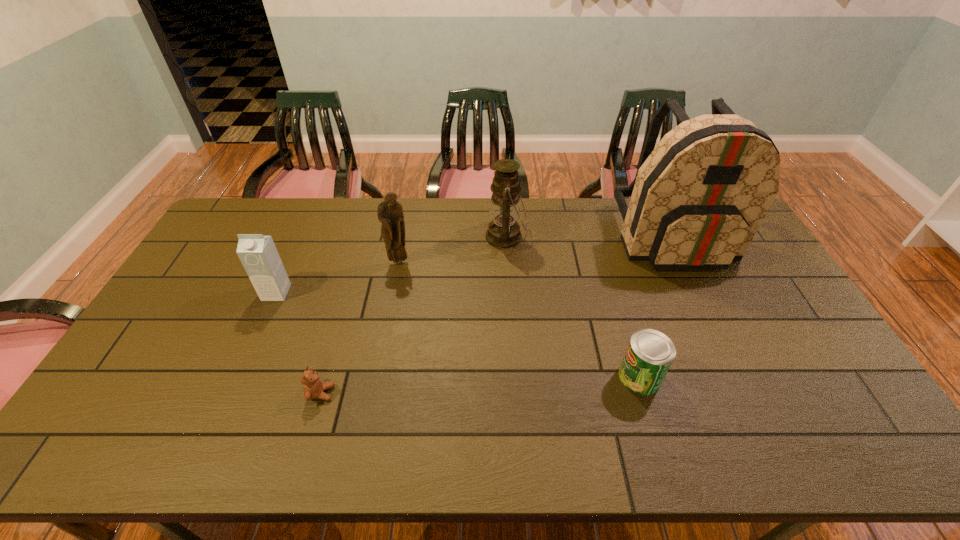
The image size is (960, 540). In order to click on vacant space at the far edge in this screenshot , I will do `click(455, 216)`.

At what (x,y) coordinates should I click in order to perform the action: click on free spot at the near edge of the desktop. Please return your answer as a coordinate pair (x, y). Image resolution: width=960 pixels, height=540 pixels. Looking at the image, I should click on (458, 434).

This screenshot has width=960, height=540. Find the location of `vacant space at the left edge of the desktop`. vacant space at the left edge of the desktop is located at coordinates (198, 315).

This screenshot has width=960, height=540. I want to click on vacant area at the right edge, so click(775, 281).

Where is `vacant area between the third nearest object and the fourth object from left to right`? This screenshot has width=960, height=540. vacant area between the third nearest object and the fourth object from left to right is located at coordinates (391, 265).

This screenshot has height=540, width=960. In order to click on vacant region between the second object from left to right and the figurine in this screenshot , I will do `click(360, 328)`.

Locate an element on the screen. The height and width of the screenshot is (540, 960). free space between the fourth object from right to left and the can is located at coordinates (519, 320).

Locate an element on the screen. This screenshot has height=540, width=960. free space between the third object from left to right and the teddy bear is located at coordinates (360, 328).

Find the location of a particular element. empty space that is in between the fourth tallest object and the third object from left to right is located at coordinates (338, 278).

The height and width of the screenshot is (540, 960). Find the location of `vacant area that lies between the third shortest object and the fifth object from right to left`. vacant area that lies between the third shortest object and the fifth object from right to left is located at coordinates (299, 343).